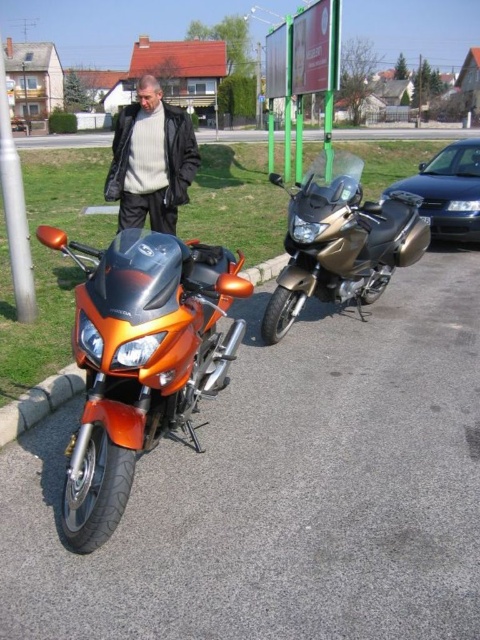
You are a delivery person who needs to park your motorcycle between the gold metallic motorcycle at center and the silver metallic pole at left. Is there enough space between them to fit your motorcycle?

The gold metallic motorcycle at center is positioned on the right side of the silver metallic pole at left, so there is space between them. However, the exact width needed for your motorcycle isn

You are a delivery person who needs to move a package from the orange Honda motorcycle to the gold metallic motorcycle at center. The package is 4 meters long. Can you place the package horizontally between them without bending it?

The distance between the orange Honda motorcycle and the gold metallic motorcycle at center is 3.96 meters. Since the package is 4 meters long, it cannot be placed horizontally between them without bending it because the space is slightly shorter than the package.

You are a delivery driver who needs to back out of a parking spot. You see the gold metallic motorcycle at center and the metallic blue sedan at right. Which vehicle should you avoid hitting while backing up?

You should avoid hitting the gold metallic motorcycle at center because it is in front of the metallic blue sedan at right, meaning it is closer to your vehicle when backing out.